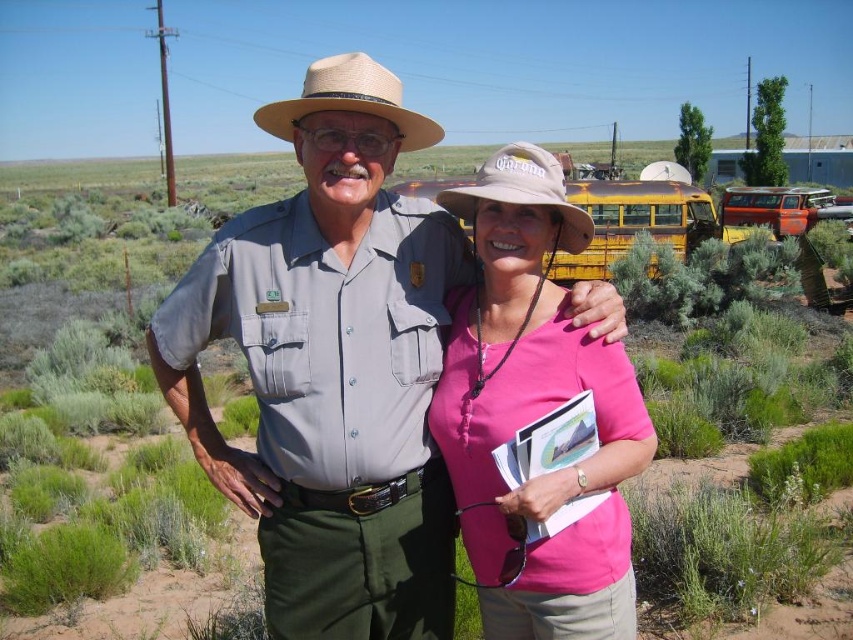
Is point (596, 218) positioned before point (279, 113)?

No, (596, 218) is further to viewer.

Does rusty metal bus at upper center appear on the right side of tan straw cowboy hat at center?

Correct, you'll find rusty metal bus at upper center to the right of tan straw cowboy hat at center.

Find the location of a particular element. This screenshot has width=853, height=640. rusty metal bus at upper center is located at coordinates (635, 221).

Is matte khaki uniform at center smaller than pink fabric shirt at center?

Yes, matte khaki uniform at center is smaller than pink fabric shirt at center.

Which is above, matte khaki uniform at center or pink fabric shirt at center?

Positioned higher is matte khaki uniform at center.

Describe the element at coordinates (332, 365) in the screenshot. The image size is (853, 640). I see `matte khaki uniform at center` at that location.

The width and height of the screenshot is (853, 640). Identify the location of matte khaki uniform at center. (332, 365).

Can you confirm if pink fabric shirt at center is bigger than rusty metal bus at upper center?

No, pink fabric shirt at center is not bigger than rusty metal bus at upper center.

Is point (482, 205) farther from camera compared to point (601, 205)?

No, (482, 205) is in front of (601, 205).

The width and height of the screenshot is (853, 640). Identify the location of pink fabric shirt at center. (535, 413).